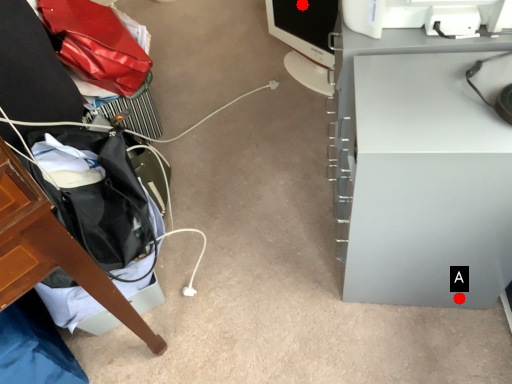
Question: Two points are circled on the image, labeled by A and B beside each circle. Which point is further to the camera?

Choices:
 (A) A is further
 (B) B is further

Answer: (B)